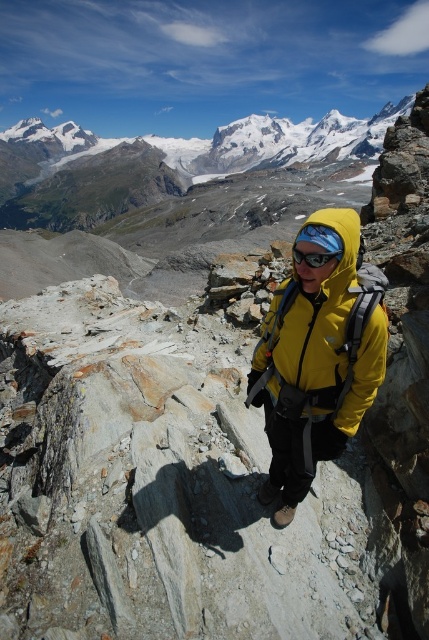
You are a hiker planning to take a photo of the yellow matte jacket at center and transparent plastic goggles at center. Which object should you focus on first if you want to capture both in the same frame without moving the camera?

The yellow matte jacket at center is taller than transparent plastic goggles at center, so you should focus on the yellow matte jacket at center first to ensure both are in focus since it is the larger object.

You are a photographer planning to take a photo of the person standing on the rocky mountain ridge. The person is at point (x=363, y=396). If your camera has a maximum focus range of 25 meters, will you be able to focus on the person?

The distance of point (x=363, y=396) from the camera is 24.97 meters, which is within the camera maximum focus range of 25 meters. Therefore, the camera can focus on the person.

You are a hiker who just arrived at the mountain ridge. You notice the yellow matte jacket at center and the transparent plastic goggles at center. Which item is located to the right of the other?

The yellow matte jacket at center is positioned on the right side of transparent plastic goggles at center.